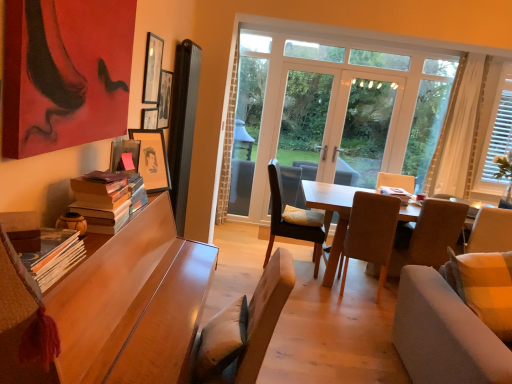
Question: In terms of width, does wooden desk at left look wider or thinner when compared to white sheer curtain at right?

Choices:
 (A) wide
 (B) thin

Answer: (A)

Question: Looking at the image, does wooden desk at left seem bigger or smaller compared to white sheer curtain at right?

Choices:
 (A) big
 (B) small

Answer: (A)

Question: Which of these objects is positioned farthest from the white wooden blinds at right, positioned as the first window in right-to-left order?

Choices:
 (A) white sheer curtain at right
 (B) wooden picture frame at upper left, marked as the third picture frame in a back-to-front arrangement
 (C) hardcover book at center, placed as the 1th book when sorted from back to front
 (D) matte black picture frame at upper left, placed as the second picture frame when sorted from front to back
 (E) wooden desk at left

Answer: (E)

Question: Estimate the real-world distances between objects in this image. Which object is farther from the brown fabric chair at center, which ranks as the 3th chair in back-to-front order?

Choices:
 (A) transparent glass door at center
 (B) hardcover books at left, the 2th book viewed from the front
 (C) dark brown leather chair at center, which appears as the 2th chair when viewed from the left
 (D) wooden picture frame at upper left, which appears as the 3th picture frame when viewed from the top
 (E) wooden picture frame at upper center, placed as the second picture frame when sorted from top to bottom

Answer: (B)